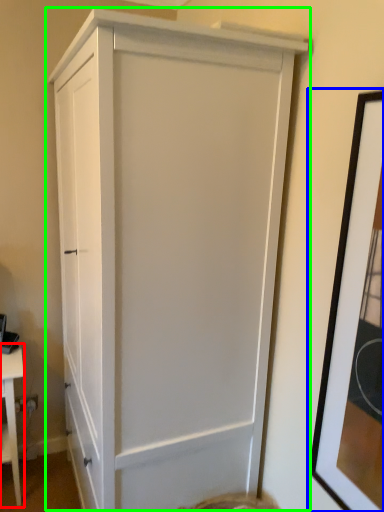
Question: Based on their relative distances, which object is farther from table (highlighted by a red box)? Choose from picture frame (highlighted by a blue box) and cupboard (highlighted by a green box).

Choices:
 (A) picture frame
 (B) cupboard

Answer: (A)